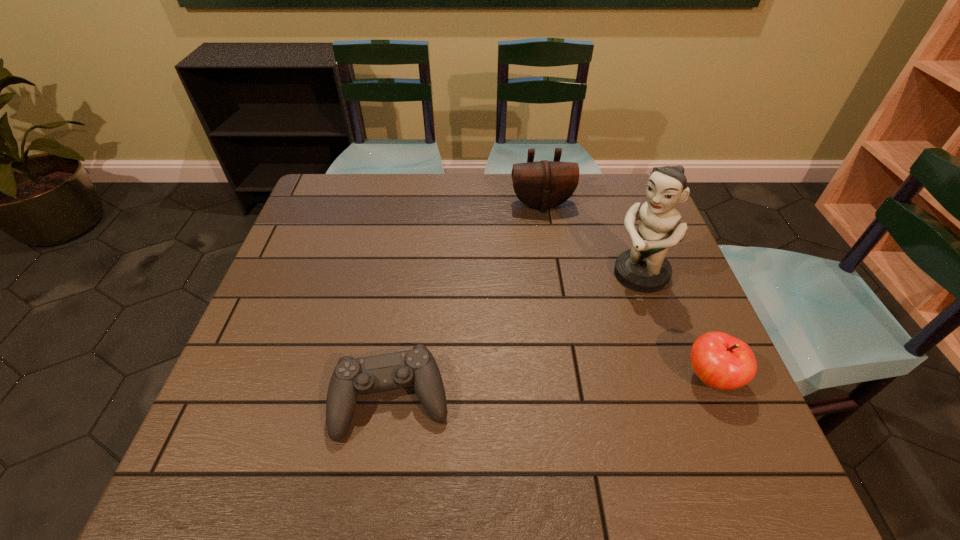
Image resolution: width=960 pixels, height=540 pixels. Find the location of `vacant point located between the second shortest object and the leftmost object`. vacant point located between the second shortest object and the leftmost object is located at coordinates (551, 389).

This screenshot has height=540, width=960. In order to click on free space between the farthest object and the leftmost object in this screenshot , I will do `click(467, 302)`.

At what (x,y) coordinates should I click in order to perform the action: click on vacant area between the second shortest object and the second object from left to right. Please return your answer as a coordinate pair (x, y). Looking at the image, I should click on (626, 291).

The image size is (960, 540). Find the location of `unoccupied position between the leftmost object and the tallest object`. unoccupied position between the leftmost object and the tallest object is located at coordinates (516, 337).

The image size is (960, 540). Find the location of `free space between the farthest object and the shortest object`. free space between the farthest object and the shortest object is located at coordinates (467, 302).

You are a GUI agent. You are given a task and a screenshot of the screen. Output one action in this format:
    pyautogui.click(x=<x>, y=<y>)
    Task: Click on the object that is the third closest to the pouch
    The image size is (960, 540).
    Given the screenshot: What is the action you would take?
    pyautogui.click(x=417, y=367)

Identify which object is the third nearest to the apple. Please provide its 2D coordinates. Your answer should be formatted as a tuple, i.e. [(x, y)], where the tuple contains the x and y coordinates of a point satisfying the conditions above.

[(544, 184)]

Locate an element on the screen. Image resolution: width=960 pixels, height=540 pixels. vacant space that satisfies the following two spatial constraints: 1. on the back side of the leftmost object; 2. on the right side of the tallest object is located at coordinates (411, 275).

In order to click on vacant space that satisfies the following two spatial constraints: 1. on the back side of the leftmost object; 2. on the left side of the second object from left to right in this screenshot , I will do `click(421, 204)`.